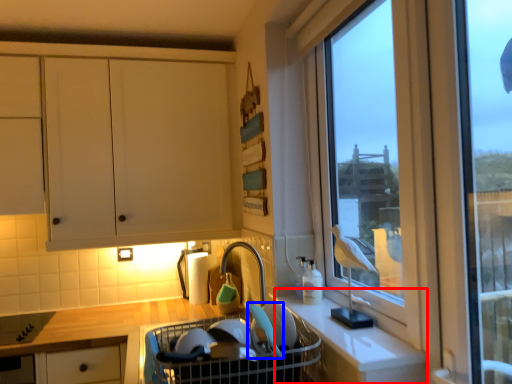
Question: Among these objects, which one is nearest to the camera, counter (highlighted by a red box) or appliance (highlighted by a blue box)?

Choices:
 (A) counter
 (B) appliance

Answer: (A)